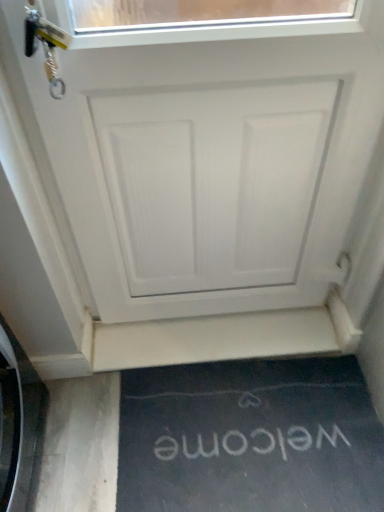
Question: Considering the positions of black rubber doormat at lower center and white matte door at center in the image, is black rubber doormat at lower center taller or shorter than white matte door at center?

Choices:
 (A) short
 (B) tall

Answer: (A)

Question: Considering the positions of point (302, 475) and point (16, 95), is point (302, 475) closer or farther from the camera than point (16, 95)?

Choices:
 (A) farther
 (B) closer

Answer: (A)

Question: Estimate the real-world distances between objects in this image. Which object is farther from the white matte door at center?

Choices:
 (A) white matte stairwell at lower center
 (B) black rubber doormat at lower center

Answer: (B)

Question: Which of these objects is positioned closest to the black rubber doormat at lower center?

Choices:
 (A) white matte door at center
 (B) white matte stairwell at lower center

Answer: (B)